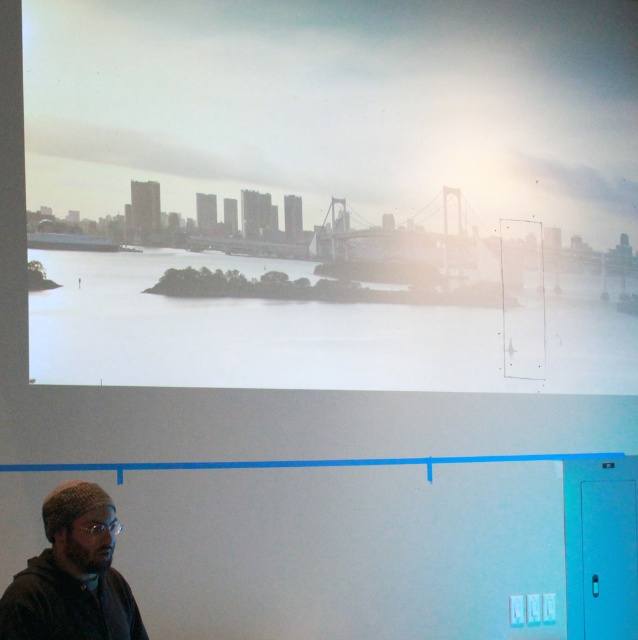
Question: Does matte white cityscape at upper center have a larger size compared to knitted wool hat at lower left?

Choices:
 (A) no
 (B) yes

Answer: (B)

Question: Which point is closer to the camera?

Choices:
 (A) (121, 582)
 (B) (115, 289)

Answer: (A)

Question: Does matte white cityscape at upper center have a lesser width compared to knitted wool hat at lower left?

Choices:
 (A) no
 (B) yes

Answer: (A)

Question: Does matte white cityscape at upper center appear over knitted wool hat at lower left?

Choices:
 (A) yes
 (B) no

Answer: (A)